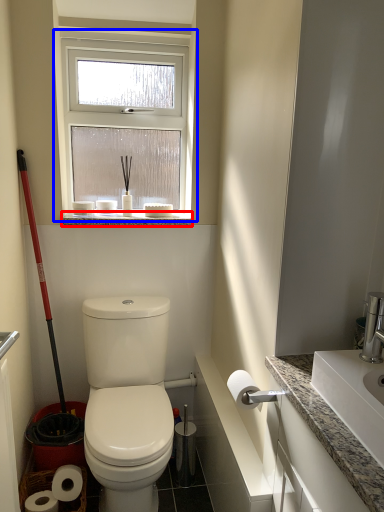
Question: Which object is further to the camera taking this photo, window sill (highlighted by a red box) or window (highlighted by a blue box)?

Choices:
 (A) window sill
 (B) window

Answer: (A)